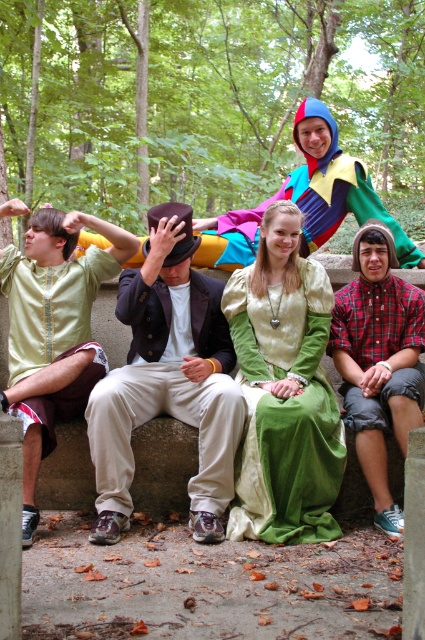
You are a photographer trying to capture a group photo of the green velvet dress at center and the plaid shirt at center. Based on their positions, which one should you focus on first to ensure they are both in focus?

The green velvet dress at center is below the plaid shirt at center, so you should focus on the plaid shirt at center first to ensure both are in focus.

You are a photographer planning to take a group photo of the green velvet dress at center and the plaid shirt at center. To ensure both are visible, you need to know their arrangement. Which one is located to the left of the other?

The green velvet dress at center is positioned on the left side of plaid shirt at center, so the green velvet dress at center is to the left of the plaid shirt at center.

You are an observer sitting on the stone bench in the forest. You notice the matte brown hat at center and the matte green fabric at left. Which object is positioned lower relative to the other?

The matte brown hat at center is positioned below the matte green fabric at left, so it is lower.